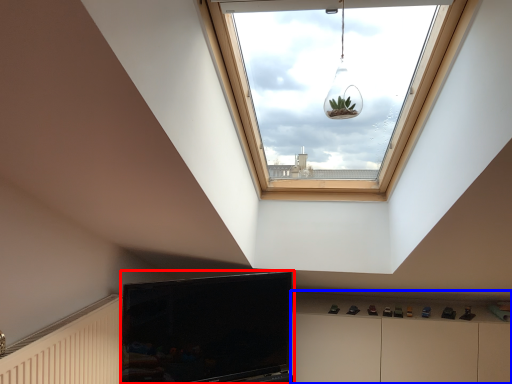
Question: Which point is closer to the camera, television (highlighted by a red box) or dresser (highlighted by a blue box)?

Choices:
 (A) television
 (B) dresser

Answer: (A)